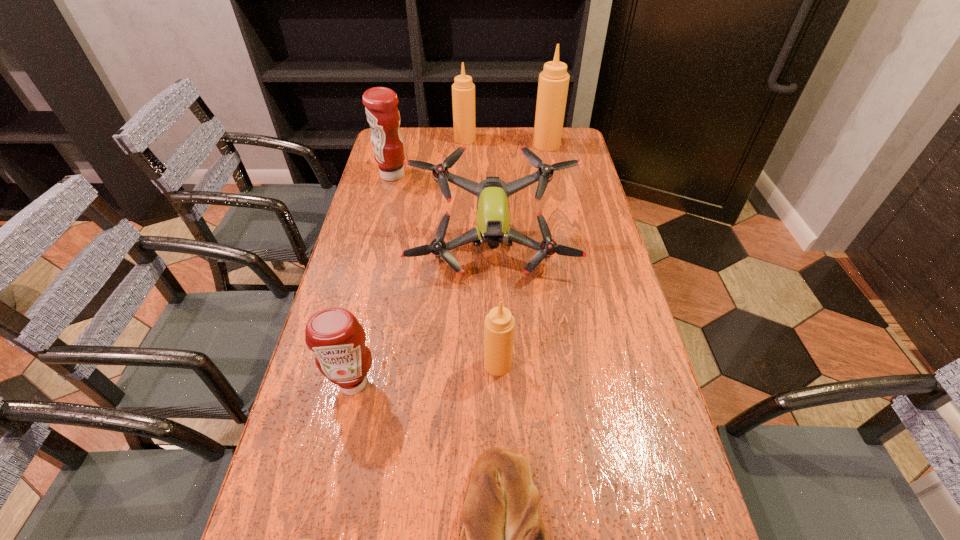
Where is `vacant space at the far edge of the desktop`? The height and width of the screenshot is (540, 960). vacant space at the far edge of the desktop is located at coordinates pos(505,147).

Identify the location of free space at the left edge of the desktop. The height and width of the screenshot is (540, 960). (361, 227).

Where is `blank space at the right edge`? This screenshot has height=540, width=960. blank space at the right edge is located at coordinates (599, 349).

The image size is (960, 540). Identify the location of vacant area at the far left corner. (408, 129).

Where is `vacant space at the far right corner of the desktop`? This screenshot has height=540, width=960. vacant space at the far right corner of the desktop is located at coordinates (566, 147).

Where is `vacant space that is in between the tallest object and the leftmost tan condiment`? The height and width of the screenshot is (540, 960). vacant space that is in between the tallest object and the leftmost tan condiment is located at coordinates (506, 142).

Identify the location of vacant area that lies between the rightmost condiment and the second smallest tan condiment. The height and width of the screenshot is (540, 960). point(506,142).

What are the coordinates of `vacant area that lies between the nearer red condiment and the third nearest condiment` in the screenshot? It's located at (372, 279).

The height and width of the screenshot is (540, 960). Identify the location of object that ranks as the closest to the lemon. (503, 539).

The width and height of the screenshot is (960, 540). I want to click on object that is the fifth nearest to the smaller red condiment, so click(x=382, y=113).